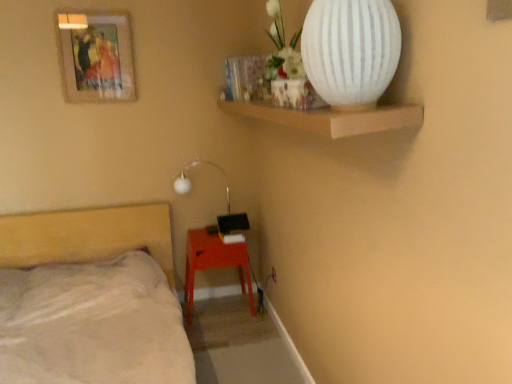
Question: Visually, is matte orange table at lower center positioned to the left or to the right of white matte lamp at upper center?

Choices:
 (A) left
 (B) right

Answer: (B)

Question: Is matte orange table at lower center in front of or behind white matte lamp at upper center in the image?

Choices:
 (A) front
 (B) behind

Answer: (A)

Question: Estimate the real-world distances between objects in this image. Which object is farther from the beige fabric bed at lower left?

Choices:
 (A) wooden framed artwork at upper left
 (B) white plastic electric outlet at lower center
 (C) matte orange table at lower center
 (D) white matte lamp at upper center
 (E) white matte vase at upper right

Answer: (E)

Question: Which is farther from the white plastic electric outlet at lower center?

Choices:
 (A) beige fabric bed at lower left
 (B) matte orange table at lower center
 (C) white matte lamp at upper center
 (D) wooden framed artwork at upper left
 (E) white matte vase at upper right

Answer: (E)